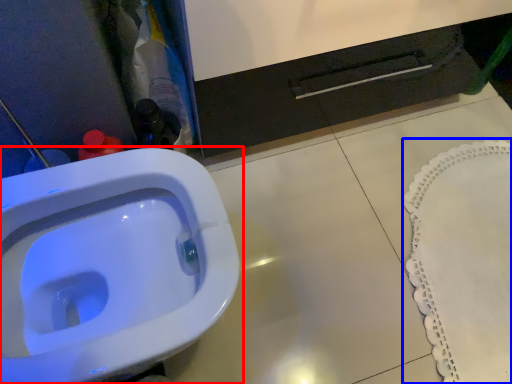
Question: Which of the following is the farthest to the observer, toilet (highlighted by a red box) or bath mat (highlighted by a blue box)?

Choices:
 (A) toilet
 (B) bath mat

Answer: (B)